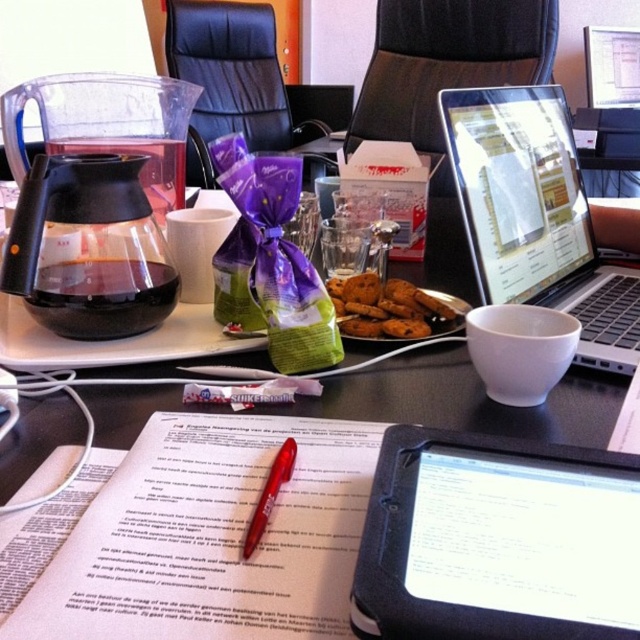
Who is lower down, white paper at center or black plastic tablet at lower center?

white paper at center

Can you confirm if white paper at center is positioned below black plastic tablet at lower center?

Yes, white paper at center is below black plastic tablet at lower center.

The height and width of the screenshot is (640, 640). Find the location of `white paper at center`. white paper at center is located at coordinates (211, 536).

Who is more distant from viewer, (604,237) or (380,285)?

Positioned behind is point (604,237).

Does point (432, 276) come in front of point (360, 324)?

No, it is not.

This screenshot has height=640, width=640. In order to click on black plastic table at center in this screenshot , I will do `click(468, 401)`.

Find the location of a particular element. The width and height of the screenshot is (640, 640). black plastic table at center is located at coordinates (468, 401).

Does white paper at center appear under silver/black laptop at upper right?

Indeed, white paper at center is positioned under silver/black laptop at upper right.

Is point (262, 554) behind point (618, 346)?

That is False.

The width and height of the screenshot is (640, 640). What are the coordinates of `white paper at center` in the screenshot? It's located at (211, 536).